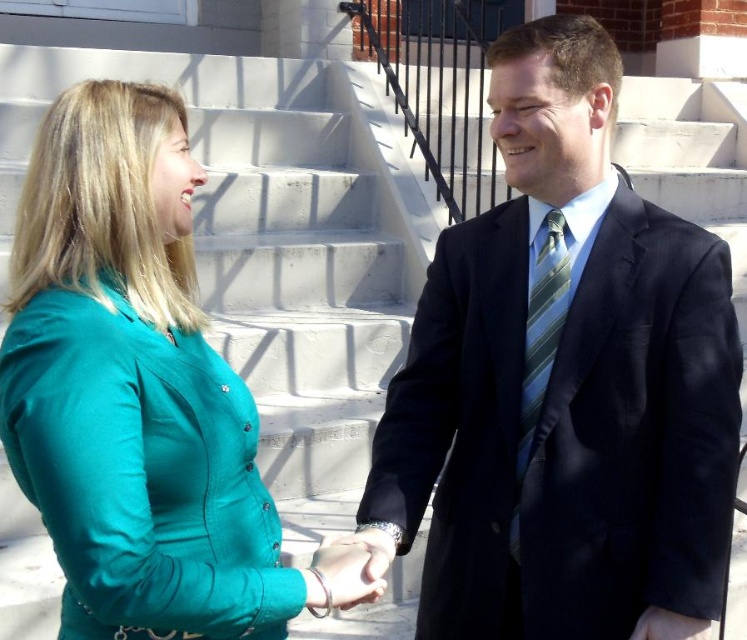
Based on the photo, does green striped tie at center have a greater height compared to smooth black hand at center?

Yes, green striped tie at center is taller than smooth black hand at center.

At what (x,y) coordinates should I click in order to perform the action: click on green striped tie at center. Please return your answer as a coordinate pair (x, y). The height and width of the screenshot is (640, 747). Looking at the image, I should click on (539, 342).

Where is `green striped tie at center`? The width and height of the screenshot is (747, 640). green striped tie at center is located at coordinates (539, 342).

Is matte black suit at center below teal fabric hand at center?

Incorrect, matte black suit at center is not positioned below teal fabric hand at center.

Can you confirm if matte black suit at center is positioned above teal fabric hand at center?

Correct, matte black suit at center is located above teal fabric hand at center.

Who is more forward, (x=524, y=568) or (x=379, y=556)?

Point (x=379, y=556)

The width and height of the screenshot is (747, 640). Find the location of `matte black suit at center`. matte black suit at center is located at coordinates (562, 380).

Does point (598, 51) lie in front of point (672, 627)?

No, it is not.

What do you see at coordinates (562, 380) in the screenshot? I see `matte black suit at center` at bounding box center [562, 380].

You are a GUI agent. You are given a task and a screenshot of the screen. Output one action in this format:
    pyautogui.click(x=<x>, y=<y>)
    Task: Click on the matte black suit at center
    
    Given the screenshot: What is the action you would take?
    pyautogui.click(x=562, y=380)